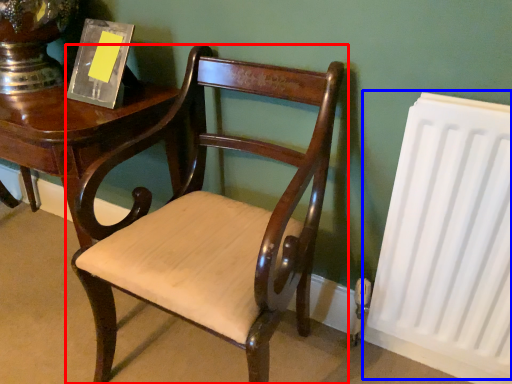
Question: Which object is closer to the camera taking this photo, chair (highlighted by a red box) or radiator (highlighted by a blue box)?

Choices:
 (A) chair
 (B) radiator

Answer: (A)